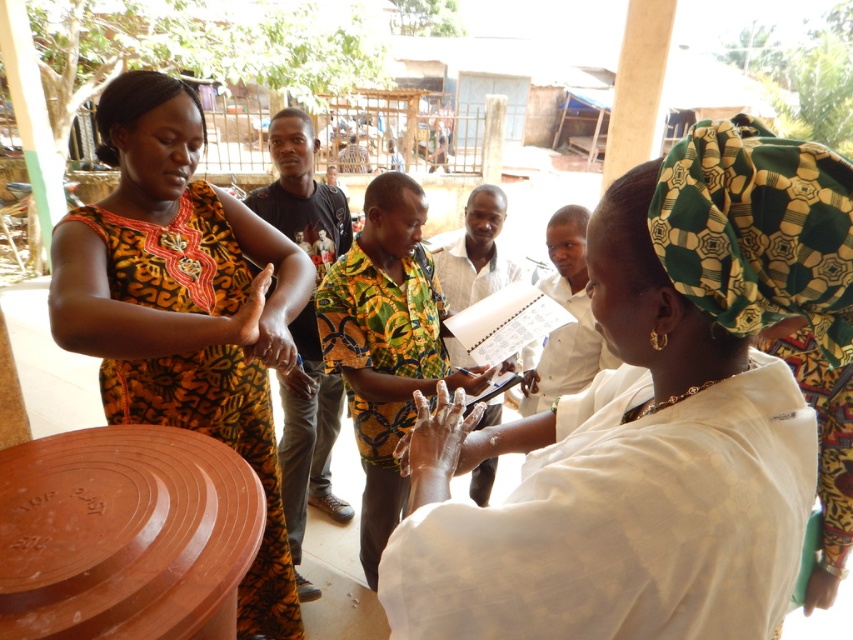
Question: Considering the relative positions of printed fabric dress at left and white cloth at center in the image provided, where is printed fabric dress at left located with respect to white cloth at center?

Choices:
 (A) right
 (B) left

Answer: (B)

Question: Which point appears farthest from the camera in this image?

Choices:
 (A) (33, 625)
 (B) (160, 260)

Answer: (B)

Question: Which point is closer to the camera?

Choices:
 (A) white cloth at center
 (B) brown clay plate at center

Answer: (A)

Question: Is printed fabric dress at left positioned in front of white cloth at center?

Choices:
 (A) yes
 (B) no

Answer: (B)

Question: Among these objects, which one is farthest from the camera?

Choices:
 (A) brown clay plate at center
 (B) white cloth at center
 (C) printed fabric dress at left

Answer: (C)

Question: In this image, where is brown clay plate at center located relative to white cloth at center?

Choices:
 (A) below
 (B) above

Answer: (A)